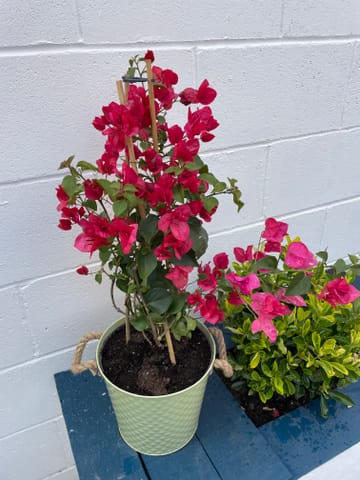
Find the location of a particular element. The width and height of the screenshot is (360, 480). white painted cinder block wall is located at coordinates (44, 111).